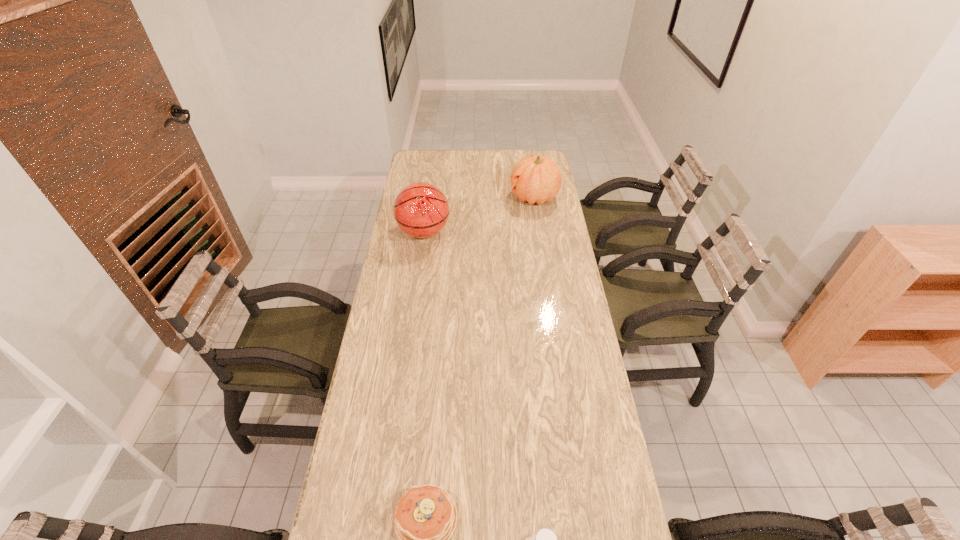
In the image, there is a desktop. Identify the location of vacant space at the right edge. The height and width of the screenshot is (540, 960). (565, 261).

Where is `free space between the farthest object and the basketball`? Image resolution: width=960 pixels, height=540 pixels. free space between the farthest object and the basketball is located at coordinates (479, 215).

Identify the location of object that is the closest one to the basketball. This screenshot has width=960, height=540. (537, 179).

Point out which object is positioned as the nearest to the water bottle. Please provide its 2D coordinates. Your answer should be formatted as a tuple, i.e. [(x, y)], where the tuple contains the x and y coordinates of a point satisfying the conditions above.

[(425, 518)]